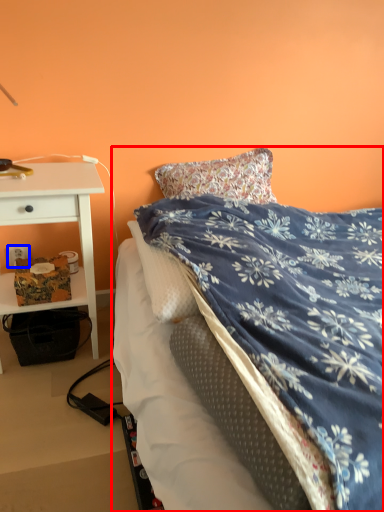
Question: Which point is further to the camera, bed (highlighted by a red box) or power outlet (highlighted by a blue box)?

Choices:
 (A) bed
 (B) power outlet

Answer: (B)